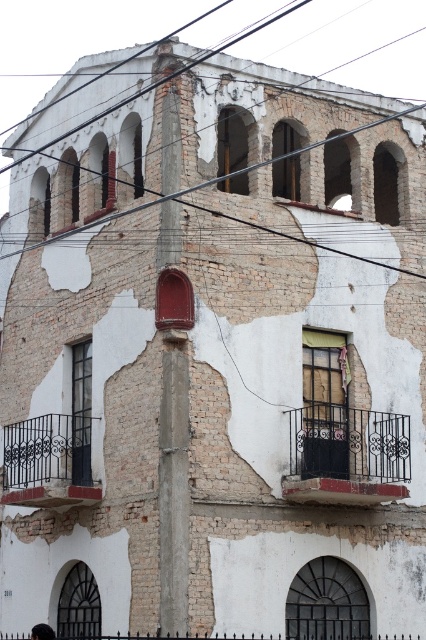
You are an architect inspecting the building. You notice the black wrought iron balcony at lower right and the black wire at upper center. Which of these two objects has a smaller width?

The black wrought iron balcony at lower right has a lesser width compared to the black wire at upper center, so the black wrought iron balcony at lower right is smaller in width.

You are standing in front of the aged building and notice a black wrought iron balcony at lower left. Where exactly is this balcony positioned in relation to the building?

The black wrought iron balcony at lower left is positioned at coordinates point (x=48, y=461).